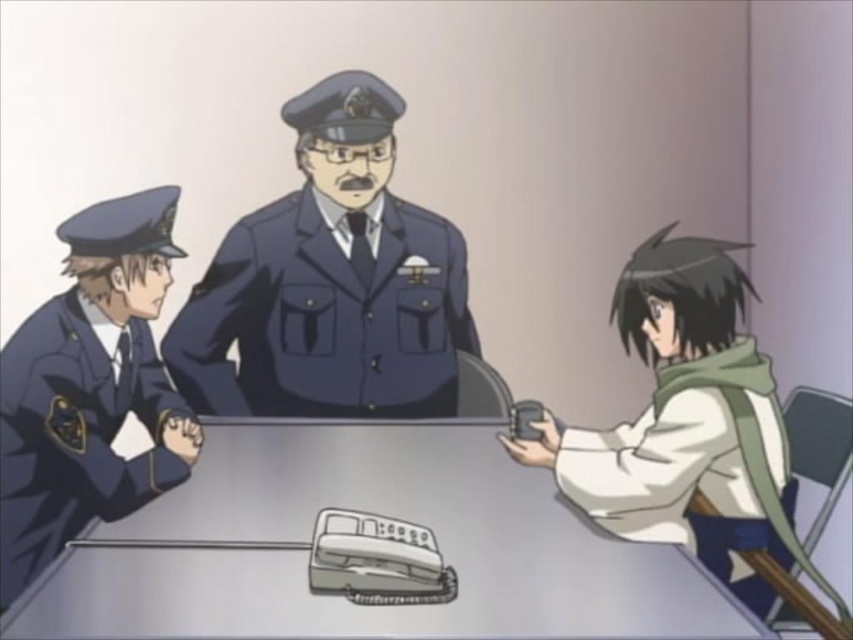
Between metallic gray table at center and matte blue uniform at left, which one has more height?

Standing taller between the two is matte blue uniform at left.

Does point (624, 625) lie in front of point (138, 356)?

Yes, it is.

Where is `metallic gray table at center`? The height and width of the screenshot is (640, 853). metallic gray table at center is located at coordinates (367, 548).

Looking at this image, is metallic gray table at center to the left of white matte scarf at lower right from the viewer's perspective?

Indeed, metallic gray table at center is positioned on the left side of white matte scarf at lower right.

Does point (538, 625) lie in front of point (672, 412)?

Yes.

You are a GUI agent. You are given a task and a screenshot of the screen. Output one action in this format:
    pyautogui.click(x=<x>, y=<y>)
    Task: Click on the metallic gray table at center
    
    Given the screenshot: What is the action you would take?
    pyautogui.click(x=367, y=548)

Is matte blue uniform at center above matte blue uniform at left?

Yes.

Who is more distant from viewer, (473, 346) or (38, 324)?

The point (473, 346) is behind.

Locate an element on the screen. This screenshot has height=640, width=853. matte blue uniform at center is located at coordinates (325, 317).